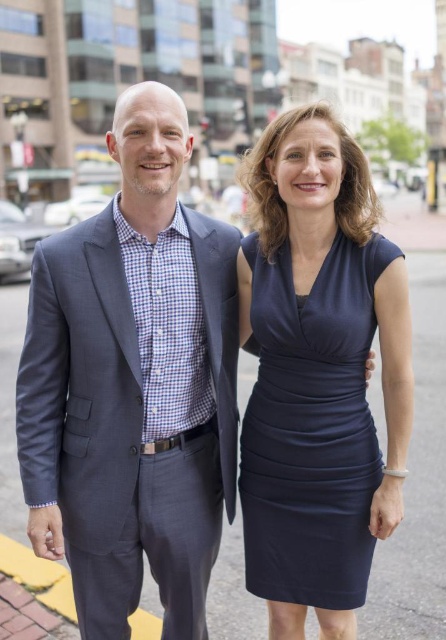
Question: Is dark blue textured suit at left to the right of dark gray asphalt at center from the viewer's perspective?

Choices:
 (A) no
 (B) yes

Answer: (A)

Question: Among these points, which one is nearest to the camera?

Choices:
 (A) (15, 483)
 (B) (70, 433)
 (C) (371, 326)

Answer: (B)

Question: Is dark blue textured suit at left to the left of navy satin dress at center from the viewer's perspective?

Choices:
 (A) no
 (B) yes

Answer: (B)

Question: Can you confirm if dark blue textured suit at left is positioned below dark gray asphalt at center?

Choices:
 (A) no
 (B) yes

Answer: (B)

Question: Which of the following is the closest to the observer?

Choices:
 (A) (81, 296)
 (B) (362, 528)

Answer: (B)

Question: Which object is the farthest from the dark blue textured suit at left?

Choices:
 (A) dark gray asphalt at center
 (B) navy satin dress at center

Answer: (A)